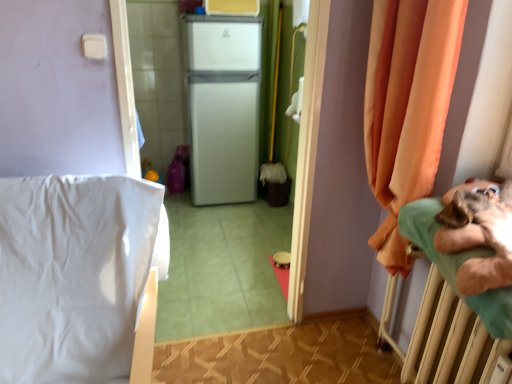
Question: Is green fabric hospital bed at right bigger than orange fabric curtain at right?

Choices:
 (A) yes
 (B) no

Answer: (B)

Question: Is green fabric hospital bed at right positioned with its back to orange fabric curtain at right?

Choices:
 (A) no
 (B) yes

Answer: (A)

Question: Can you confirm if green fabric hospital bed at right is smaller than orange fabric curtain at right?

Choices:
 (A) no
 (B) yes

Answer: (B)

Question: Is green fabric hospital bed at right to the right of orange fabric curtain at right from the viewer's perspective?

Choices:
 (A) yes
 (B) no

Answer: (A)

Question: Does green fabric hospital bed at right have a lesser height compared to orange fabric curtain at right?

Choices:
 (A) no
 (B) yes

Answer: (B)

Question: Is point (216, 107) closer or farther from the camera than point (431, 3)?

Choices:
 (A) closer
 (B) farther

Answer: (B)

Question: From a real-world perspective, relative to orange fabric curtain at right, is white matte refrigerator at center vertically above or below?

Choices:
 (A) above
 (B) below

Answer: (B)

Question: Is white matte refrigerator at center inside or outside of orange fabric curtain at right?

Choices:
 (A) inside
 (B) outside

Answer: (B)

Question: In terms of size, does white matte refrigerator at center appear bigger or smaller than orange fabric curtain at right?

Choices:
 (A) big
 (B) small

Answer: (A)

Question: In terms of size, does orange fabric curtain at right appear bigger or smaller than white smooth bedsheet at left?

Choices:
 (A) small
 (B) big

Answer: (A)

Question: From the image's perspective, is orange fabric curtain at right above or below white smooth bedsheet at left?

Choices:
 (A) below
 (B) above

Answer: (B)

Question: Visually, is orange fabric curtain at right positioned to the left or to the right of white smooth bedsheet at left?

Choices:
 (A) right
 (B) left

Answer: (A)

Question: In the image, is orange fabric curtain at right positioned in front of or behind white smooth bedsheet at left?

Choices:
 (A) front
 (B) behind

Answer: (B)

Question: Considering their positions, is green fabric hospital bed at right located in front of or behind white matte refrigerator at center?

Choices:
 (A) front
 (B) behind

Answer: (A)

Question: Considering the relative positions of green fabric hospital bed at right and white matte refrigerator at center in the image provided, is green fabric hospital bed at right to the left or to the right of white matte refrigerator at center?

Choices:
 (A) right
 (B) left

Answer: (A)